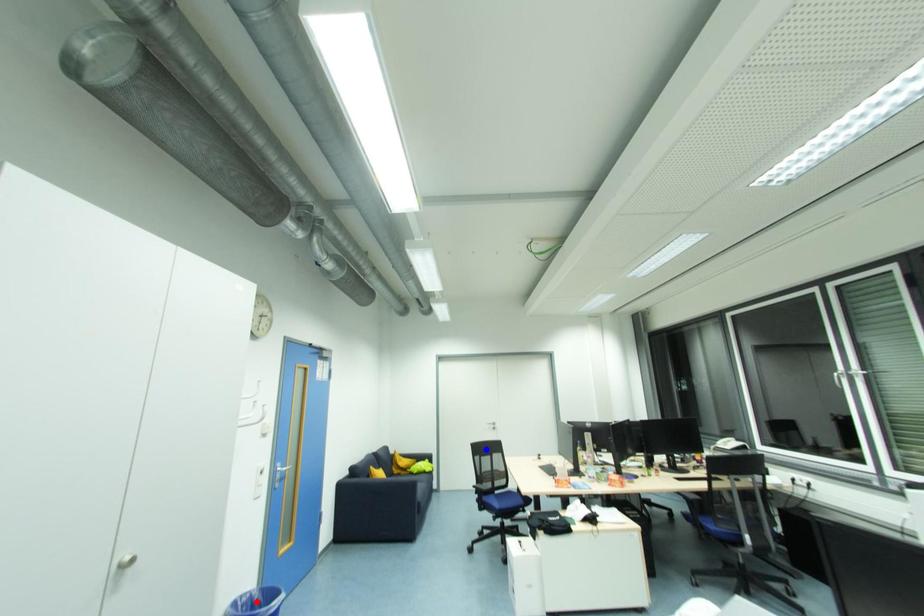
Question: In the image, two points are highlighted. Which point is nearer to the camera? Reply with the corresponding letter.

Choices:
 (A) blue point
 (B) red point

Answer: (B)